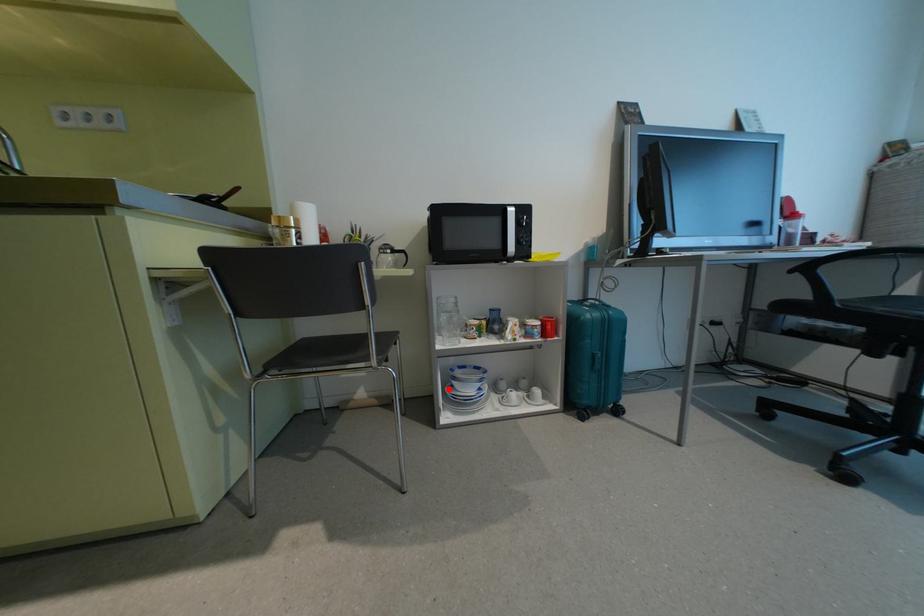
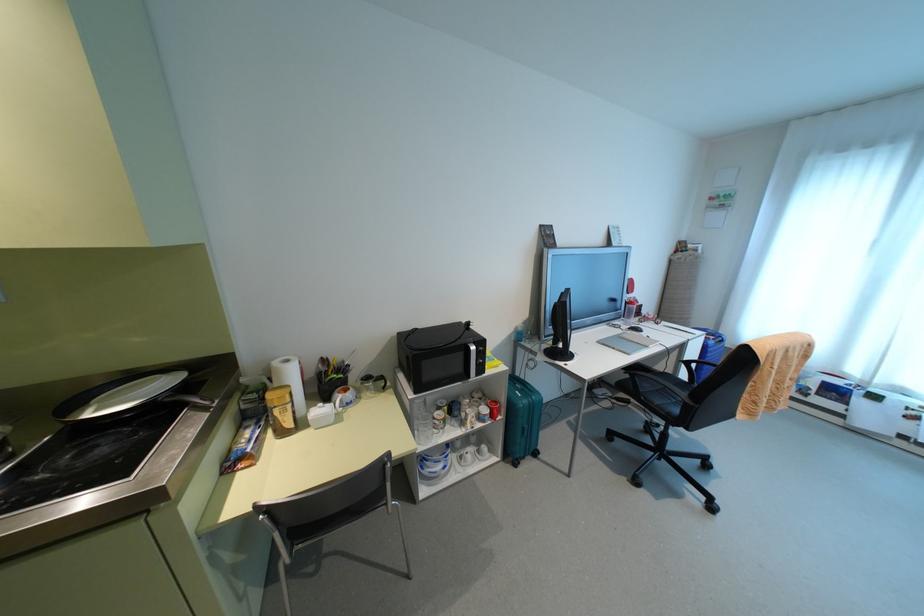
The point at the highlighted location is marked in the first image. Where is the corresponding point in the second image?

(420, 466)